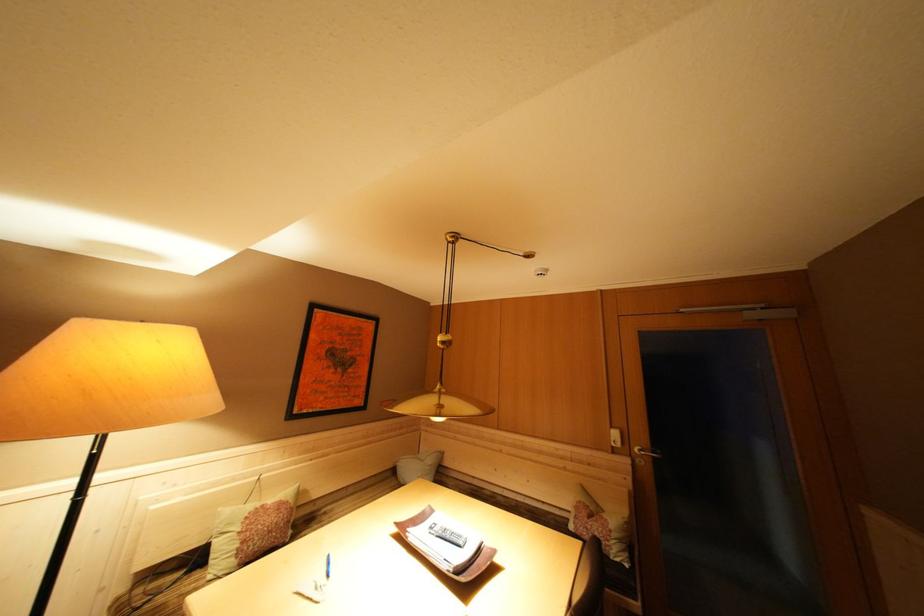
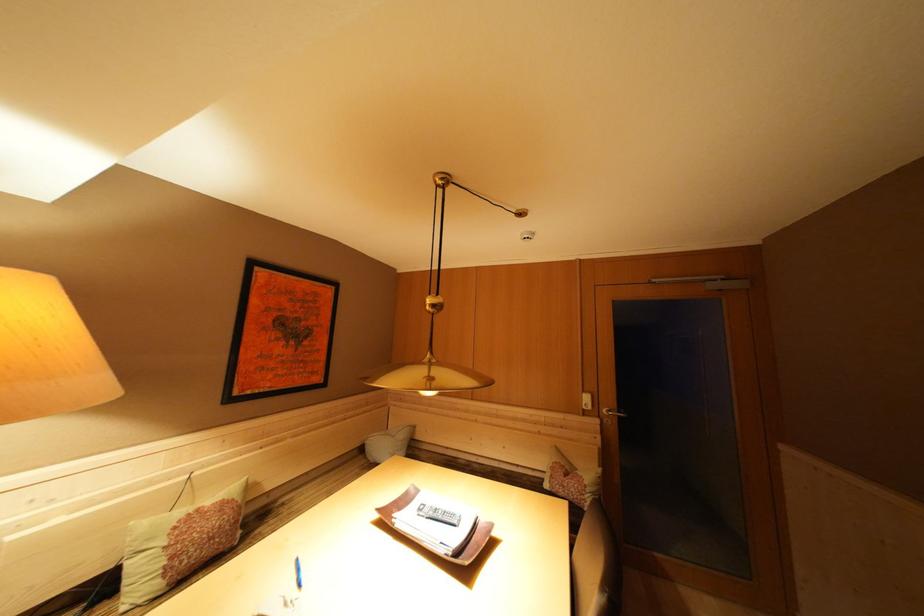
The point at [438,466] is marked in the first image. Where is the corresponding point in the second image?

(408, 440)